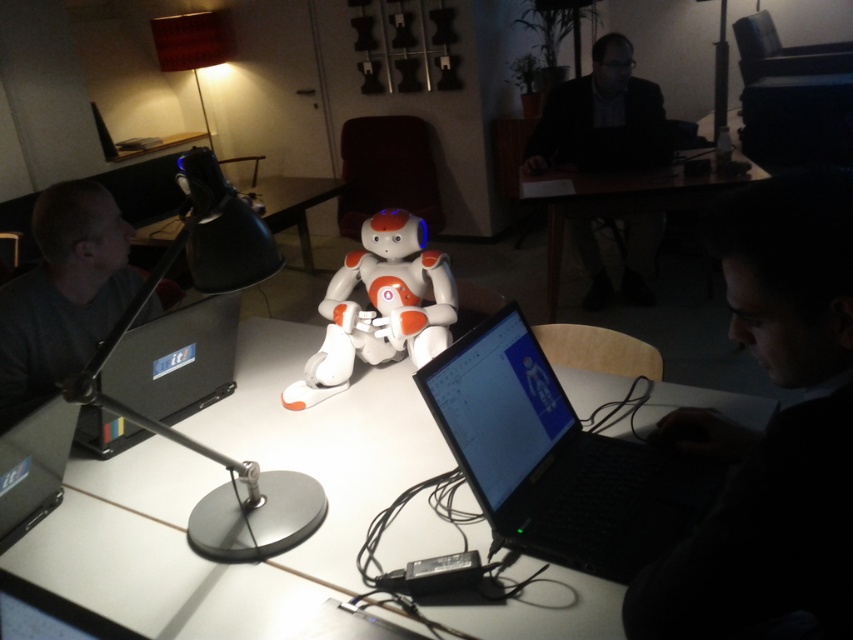
Question: Which point is closer to the camera taking this photo?

Choices:
 (A) (102, 388)
 (B) (83, 193)
 (C) (280, 563)

Answer: (C)

Question: Can you confirm if black metallic desk lamp at left is positioned to the right of wooden table at center?

Choices:
 (A) no
 (B) yes

Answer: (A)

Question: Considering the relative positions of gray matte shirt at left and matte black laptop at left in the image provided, where is gray matte shirt at left located with respect to matte black laptop at left?

Choices:
 (A) below
 (B) above

Answer: (B)

Question: Is gray matte shirt at left below matte black laptop at left?

Choices:
 (A) yes
 (B) no

Answer: (B)

Question: Which object appears closest to the camera in this image?

Choices:
 (A) matte black laptop at left
 (B) black matte laptop at lower right

Answer: (B)

Question: Which point is closer to the camera?

Choices:
 (A) (6, 468)
 (B) (158, 336)

Answer: (A)